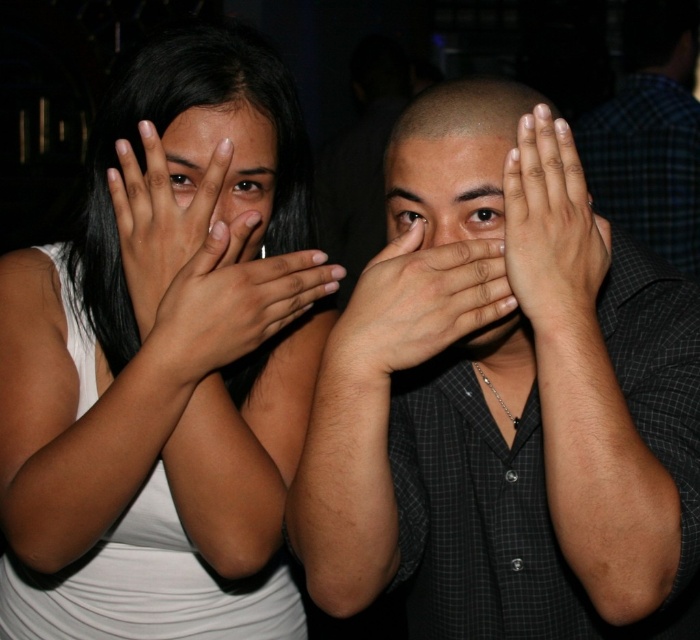
Does matte skin hand at center lie behind dark skin tone hand at center?

Yes, it is behind dark skin tone hand at center.

Can you confirm if matte skin hand at center is positioned to the right of dark skin tone hand at center?

In fact, matte skin hand at center is to the left of dark skin tone hand at center.

Between point (130, 198) and point (489, 269), which one is positioned in front?

Positioned in front is point (489, 269).

Where is `matte skin hand at center`? The width and height of the screenshot is (700, 640). matte skin hand at center is located at coordinates (175, 220).

Looking at this image, is white matte tank top at upper left wider than smooth skin hands at center?

Yes.

Is point (274, 492) farther from camera compared to point (552, 188)?

Yes, it is behind point (552, 188).

Who is more distant from viewer, (253,259) or (568,188)?

The point (253,259) is more distant.

Identify the location of white matte tank top at upper left. (167, 368).

Does smooth skin hands at center have a greater width compared to dark skin tone hand at center?

No.

Which is below, smooth skin hands at center or dark skin tone hand at center?

dark skin tone hand at center

Does point (598, 253) lie behind point (407, 332)?

Yes, point (598, 253) is behind point (407, 332).

Locate an element on the screen. The width and height of the screenshot is (700, 640). smooth skin hands at center is located at coordinates (x=552, y=227).